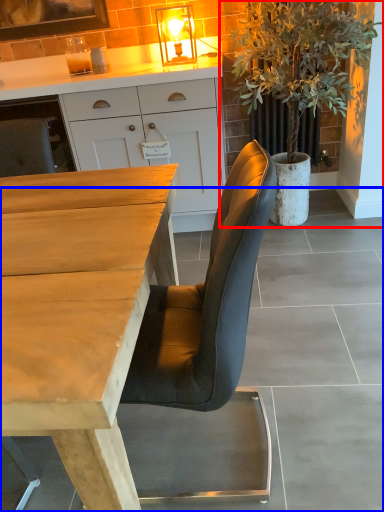
Question: Which of the following is the farthest to the observer, houseplant (highlighted by a red box) or concrete (highlighted by a blue box)?

Choices:
 (A) houseplant
 (B) concrete

Answer: (A)